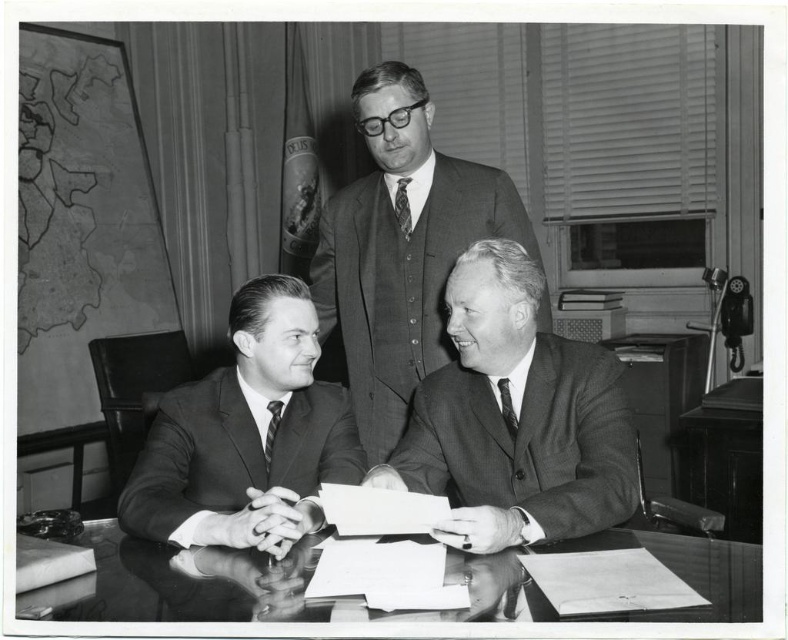
Between point (404, 193) and point (504, 404), which one is positioned in front?

Point (504, 404) is in front.

Is textured silk tie at upper center positioned behind dark gray textured tie at center?

Yes, it is.

Where is `textured silk tie at upper center`? The width and height of the screenshot is (788, 640). textured silk tie at upper center is located at coordinates (402, 205).

Which is above, smooth suit at center or striped silk tie at center?

Positioned higher is smooth suit at center.

Is point (461, 308) farther from viewer compared to point (270, 401)?

No, (461, 308) is closer to viewer.

Does point (489, 449) come in front of point (268, 422)?

Yes.

At what (x,y) coordinates should I click in order to perform the action: click on smooth suit at center. Please return your answer as a coordinate pair (x, y). Image resolution: width=788 pixels, height=640 pixels. Looking at the image, I should click on (515, 417).

Who is positioned more to the right, dark gray suit at center or textured silk tie at upper center?

textured silk tie at upper center

Describe the element at coordinates (246, 435) in the screenshot. I see `dark gray suit at center` at that location.

Identify the location of dark gray suit at center. (246, 435).